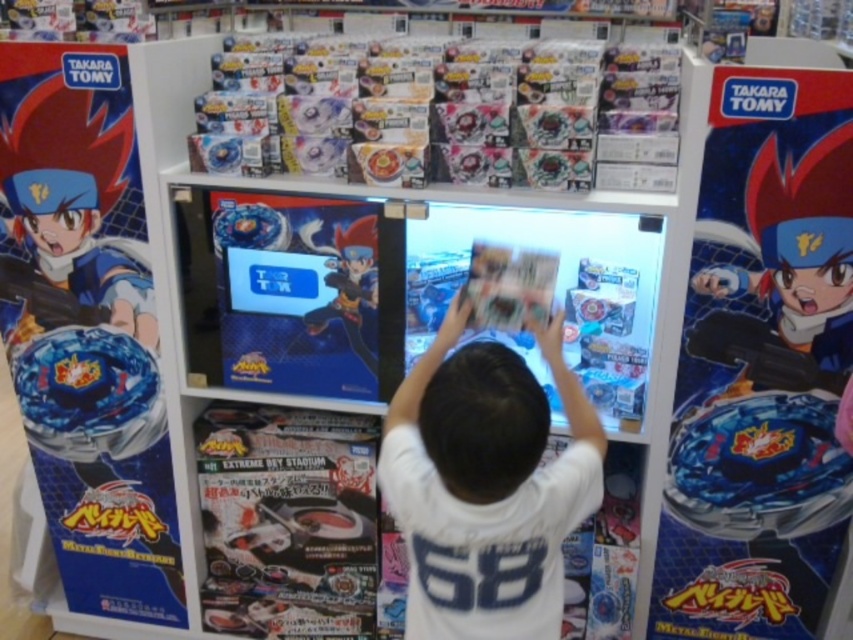
Question: Where is white cotton shirt at center located in relation to shiny blue figure at center in the image?

Choices:
 (A) left
 (B) right

Answer: (B)

Question: Does white cotton shirt at center have a lesser width compared to shiny blue figure at center?

Choices:
 (A) yes
 (B) no

Answer: (B)

Question: Considering the relative positions of white cotton shirt at center and shiny blue figure at center in the image provided, where is white cotton shirt at center located with respect to shiny blue figure at center?

Choices:
 (A) left
 (B) right

Answer: (B)